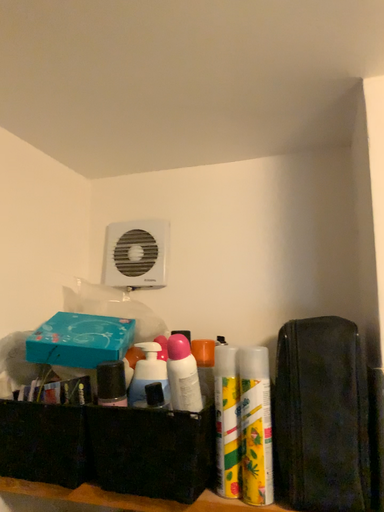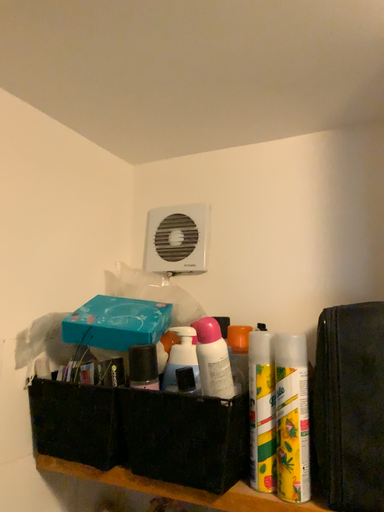
Question: How did the camera likely rotate when shooting the video?

Choices:
 (A) rotated right
 (B) rotated left

Answer: (B)